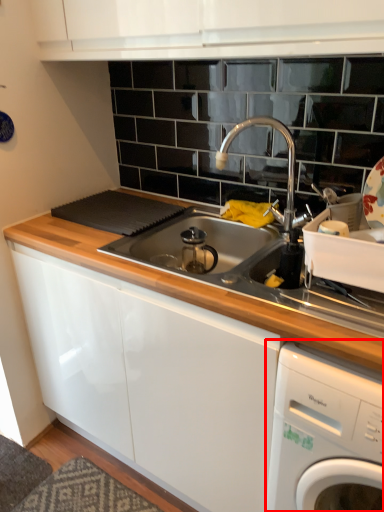
Question: From the image, what is the correct spatial relationship of home appliance (annotated by the red box) in relation to tap?

Choices:
 (A) right
 (B) left

Answer: (A)